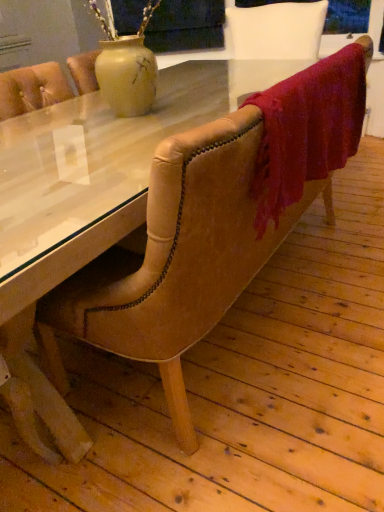
Question: In the image, is transparent glass table at center positioned in front of or behind velvet red blanket at upper right?

Choices:
 (A) behind
 (B) front

Answer: (B)

Question: From a real-world perspective, is transparent glass table at center above or below velvet red blanket at upper right?

Choices:
 (A) below
 (B) above

Answer: (A)

Question: Is transparent glass table at center inside the boundaries of velvet red blanket at upper right, or outside?

Choices:
 (A) outside
 (B) inside

Answer: (A)

Question: Which is correct: velvet red blanket at upper right is inside transparent glass table at center, or outside of it?

Choices:
 (A) inside
 (B) outside

Answer: (B)

Question: Looking at the image, does velvet red blanket at upper right seem bigger or smaller compared to transparent glass table at center?

Choices:
 (A) big
 (B) small

Answer: (B)

Question: In terms of width, does velvet red blanket at upper right look wider or thinner when compared to transparent glass table at center?

Choices:
 (A) thin
 (B) wide

Answer: (A)

Question: Is point (355, 70) closer or farther from the camera than point (142, 147)?

Choices:
 (A) closer
 (B) farther

Answer: (B)